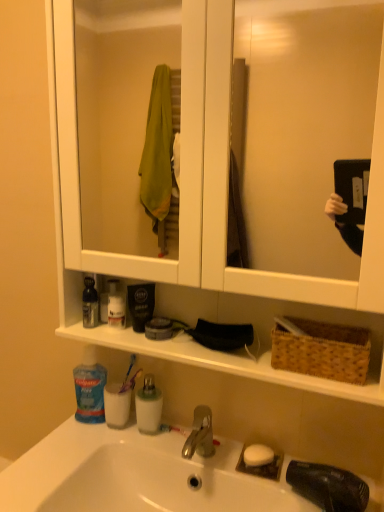
Question: From a real-world perspective, is blue translucent mouthwash at center, acting as the 1th mouthwash starting from the top, located beneath purple plastic toothbrush at lower center?

Choices:
 (A) yes
 (B) no

Answer: (B)

Question: Is purple plastic toothbrush at lower center surrounded by blue translucent mouthwash at center, acting as the 1th mouthwash starting from the top?

Choices:
 (A) no
 (B) yes

Answer: (A)

Question: Can you confirm if blue translucent mouthwash at center, acting as the 1th mouthwash starting from the top, is bigger than purple plastic toothbrush at lower center?

Choices:
 (A) yes
 (B) no

Answer: (A)

Question: Is blue translucent mouthwash at center, acting as the 1th mouthwash starting from the top, closer to camera compared to purple plastic toothbrush at lower center?

Choices:
 (A) no
 (B) yes

Answer: (B)

Question: Does blue translucent mouthwash at center, marked as the 2th mouthwash in a bottom-to-top arrangement, have a lesser height compared to purple plastic toothbrush at lower center?

Choices:
 (A) yes
 (B) no

Answer: (B)

Question: From the image's perspective, is blue translucent mouthwash at center, marked as the 2th mouthwash in a bottom-to-top arrangement, located beneath purple plastic toothbrush at lower center?

Choices:
 (A) yes
 (B) no

Answer: (B)

Question: Can you confirm if white glossy sink at lower center is positioned to the left of white opaque cup at lower left, the first mouthwash from the bottom?

Choices:
 (A) no
 (B) yes

Answer: (A)

Question: From the image's perspective, does white glossy sink at lower center appear higher than white opaque cup at lower left, acting as the 2th mouthwash starting from the top?

Choices:
 (A) yes
 (B) no

Answer: (B)

Question: Considering the relative positions of white glossy sink at lower center and white opaque cup at lower left, the first mouthwash from the bottom, in the image provided, is white glossy sink at lower center behind white opaque cup at lower left, the first mouthwash from the bottom,?

Choices:
 (A) yes
 (B) no

Answer: (B)

Question: Does white glossy sink at lower center have a lesser height compared to white opaque cup at lower left, acting as the 2th mouthwash starting from the top?

Choices:
 (A) yes
 (B) no

Answer: (B)

Question: From the image's perspective, does white glossy sink at lower center appear lower than white opaque cup at lower left, acting as the 2th mouthwash starting from the top?

Choices:
 (A) no
 (B) yes

Answer: (B)

Question: Does white glossy sink at lower center have a greater height compared to white opaque cup at lower left, the first mouthwash from the bottom?

Choices:
 (A) no
 (B) yes

Answer: (B)

Question: Is white opaque cup at lower left, the first mouthwash from the bottom, oriented towards brown woven basket at right?

Choices:
 (A) no
 (B) yes

Answer: (A)